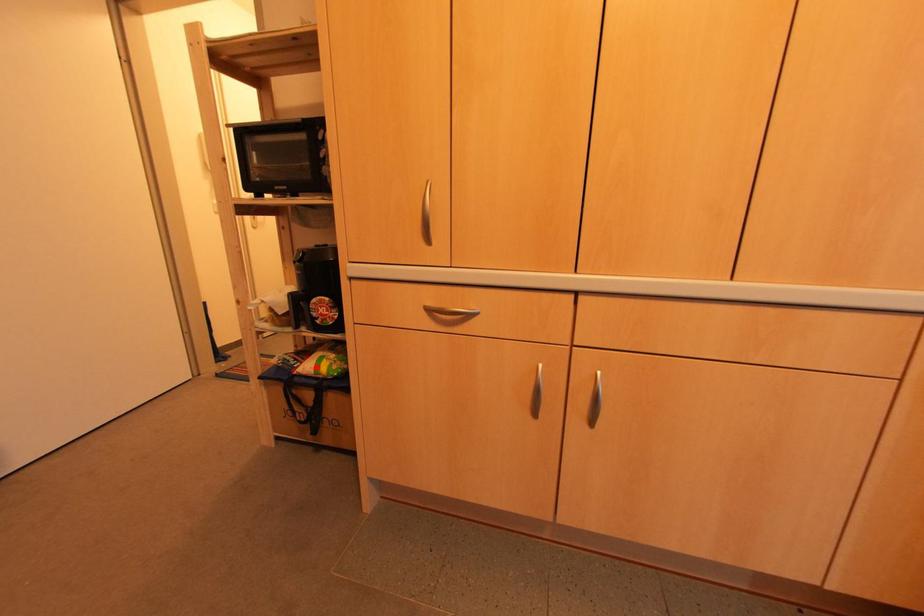
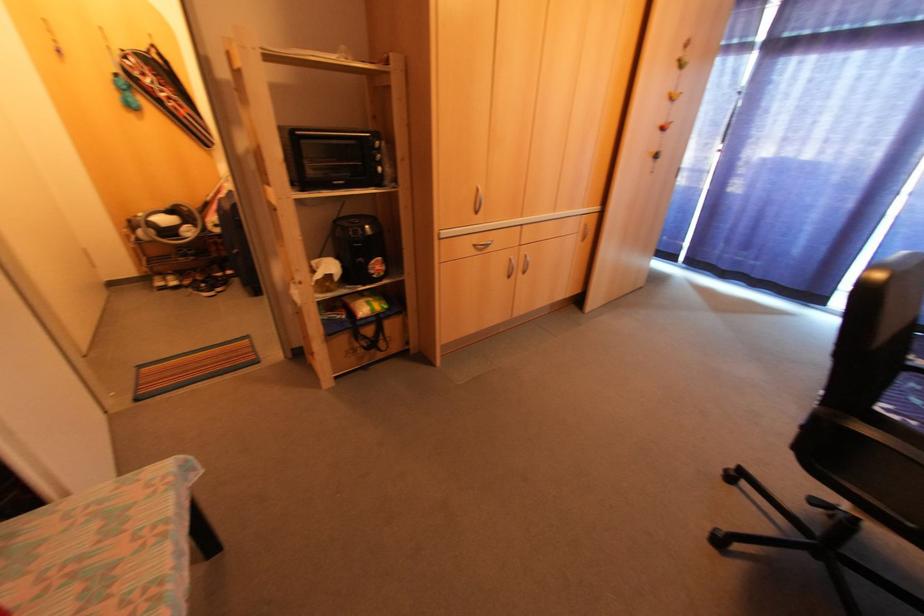
Locate, in the second image, the point that corresponds to the highlighted location in the first image.

(370, 309)